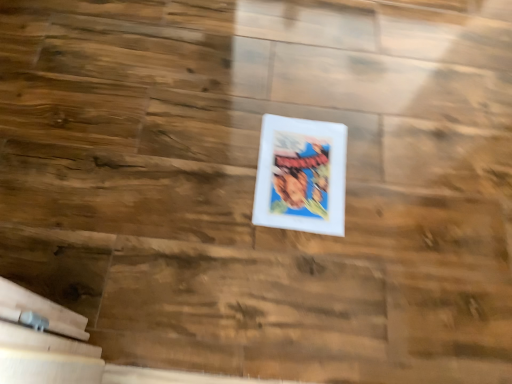
Locate an element on the screen. The width and height of the screenshot is (512, 384). free spot below white matte picture frame at center (from a real-world perspective) is located at coordinates coord(302,176).